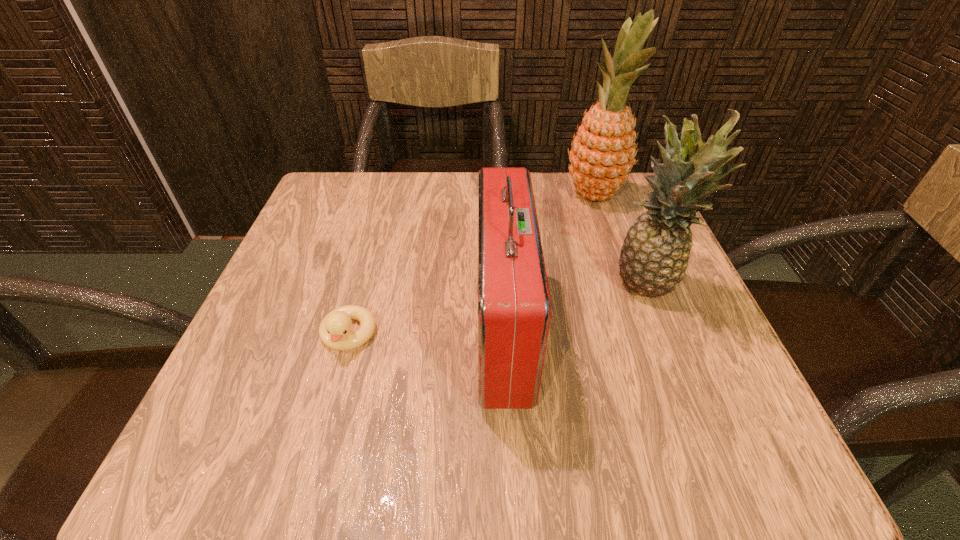
The height and width of the screenshot is (540, 960). Identify the location of unoccupied area between the tallest object and the first-aid kit. (549, 263).

Find the location of a particular element. This screenshot has height=540, width=960. free space between the shortest object and the tallest object is located at coordinates (471, 265).

Where is `object that stands as the closest to the first-aid kit`? object that stands as the closest to the first-aid kit is located at coordinates (654, 256).

Point out which object is positioned as the second nearest to the leftmost object. Please provide its 2D coordinates. Your answer should be formatted as a tuple, i.e. [(x, y)], where the tuple contains the x and y coordinates of a point satisfying the conditions above.

[(654, 256)]

Where is `free spot that satisfies the following two spatial constraints: 1. on the front side of the farther pineapple; 2. on the left side of the nearer pineapple`? This screenshot has width=960, height=540. free spot that satisfies the following two spatial constraints: 1. on the front side of the farther pineapple; 2. on the left side of the nearer pineapple is located at coordinates (626, 287).

The width and height of the screenshot is (960, 540). In order to click on free space that satisfies the following two spatial constraints: 1. on the side of the third tallest object with the first aid cross symbol; 2. at the beak of the shortest object in this screenshot , I will do `click(503, 335)`.

This screenshot has height=540, width=960. Find the location of `free point that satisfies the following two spatial constraints: 1. on the side of the second shortest object with the first aid cross symbol; 2. at the beak of the leftmost object`. free point that satisfies the following two spatial constraints: 1. on the side of the second shortest object with the first aid cross symbol; 2. at the beak of the leftmost object is located at coordinates (503, 335).

Where is `free point that satisfies the following two spatial constraints: 1. on the front side of the taller pineapple; 2. on the side of the third object from right to left with the first aid cross symbol`? free point that satisfies the following two spatial constraints: 1. on the front side of the taller pineapple; 2. on the side of the third object from right to left with the first aid cross symbol is located at coordinates (641, 330).